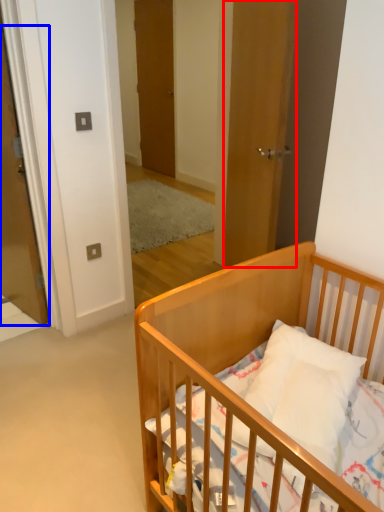
Question: Which of the following is the farthest to the observer, door (highlighted by a red box) or door (highlighted by a blue box)?

Choices:
 (A) door
 (B) door

Answer: (B)